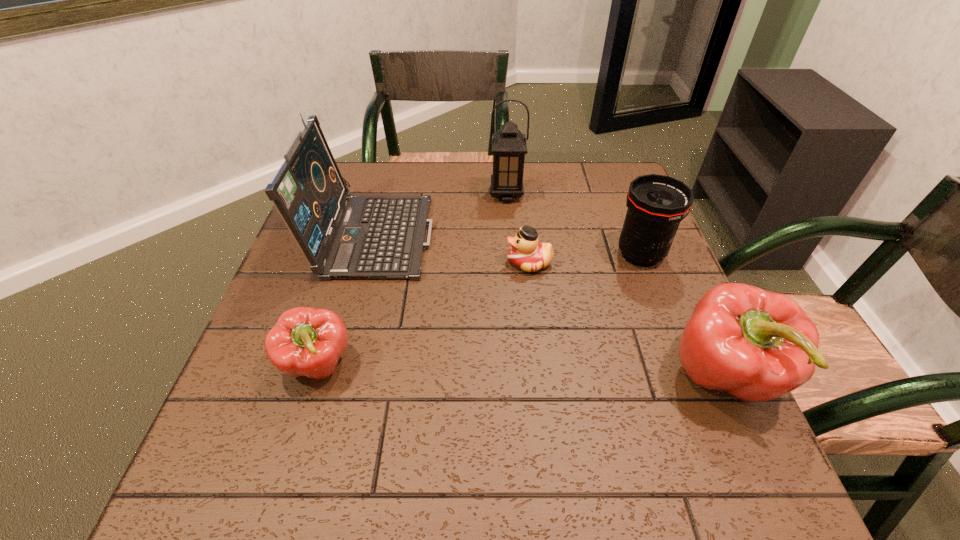
Where is `vacant space that's between the laptop computer and the fifth tallest object`? Image resolution: width=960 pixels, height=540 pixels. vacant space that's between the laptop computer and the fifth tallest object is located at coordinates (347, 299).

This screenshot has height=540, width=960. Identify the location of free area in between the laptop computer and the telephoto lens. (507, 244).

The height and width of the screenshot is (540, 960). I want to click on vacant point located between the right pepper and the shorter pepper, so click(521, 370).

At what (x,y) coordinates should I click in order to perform the action: click on free space between the lantern and the telephoto lens. Please return your answer as a coordinate pair (x, y). Looking at the image, I should click on (573, 225).

I want to click on free space between the shorter pepper and the shortest object, so click(x=423, y=313).

This screenshot has height=540, width=960. I want to click on vacant area that lies between the telephoto lens and the laptop computer, so click(507, 244).

You are a GUI agent. You are given a task and a screenshot of the screen. Output one action in this format:
    pyautogui.click(x=<x>, y=<y>)
    Task: Click on the unoccupied area between the laptop computer and the telephoto lens
    
    Given the screenshot: What is the action you would take?
    pyautogui.click(x=507, y=244)

I want to click on empty space between the telephoto lens and the laptop computer, so click(x=507, y=244).

Where is `unoccupied position between the laptop computer and the right pepper`? unoccupied position between the laptop computer and the right pepper is located at coordinates (549, 305).

Locate which object ranks second in proximity to the laptop computer. Please provide its 2D coordinates. Your answer should be formatted as a tuple, i.e. [(x, y)], where the tuple contains the x and y coordinates of a point satisfying the conditions above.

[(305, 341)]